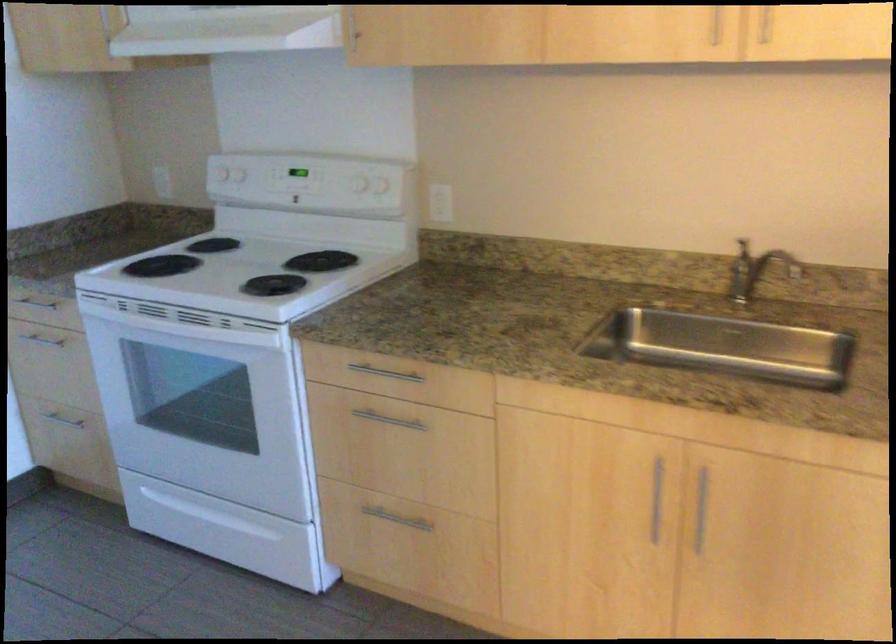
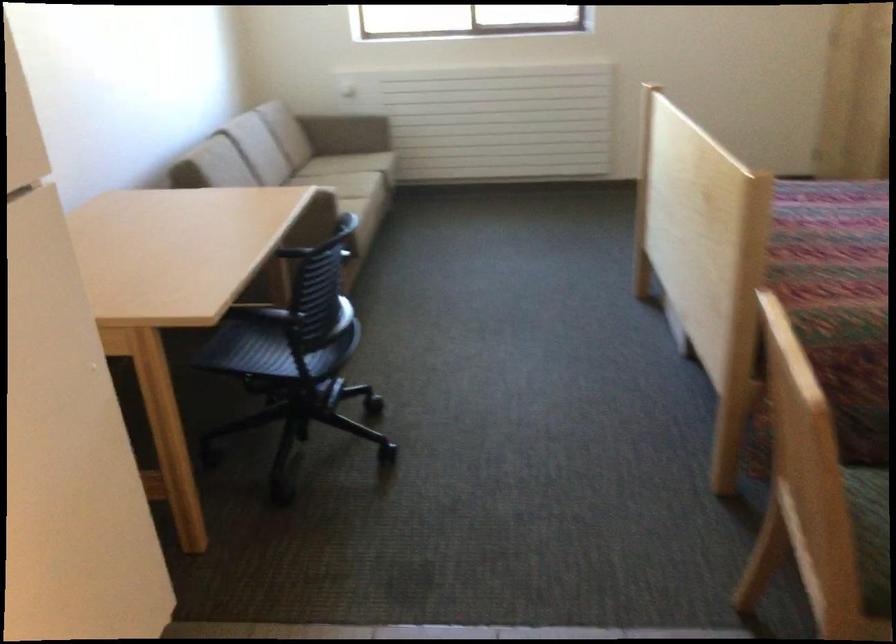
First-person continuous shooting, in which direction is the camera rotating?

The rotation direction of the camera is right-down.